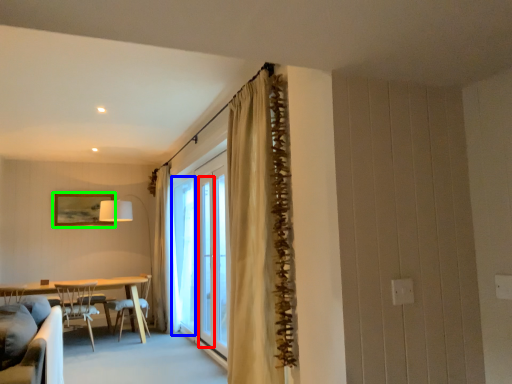
Question: Which object is positioned closest to screen door (highlighted by a red box)? Select from window (highlighted by a blue box) and picture frame (highlighted by a green box).

Choices:
 (A) window
 (B) picture frame

Answer: (A)